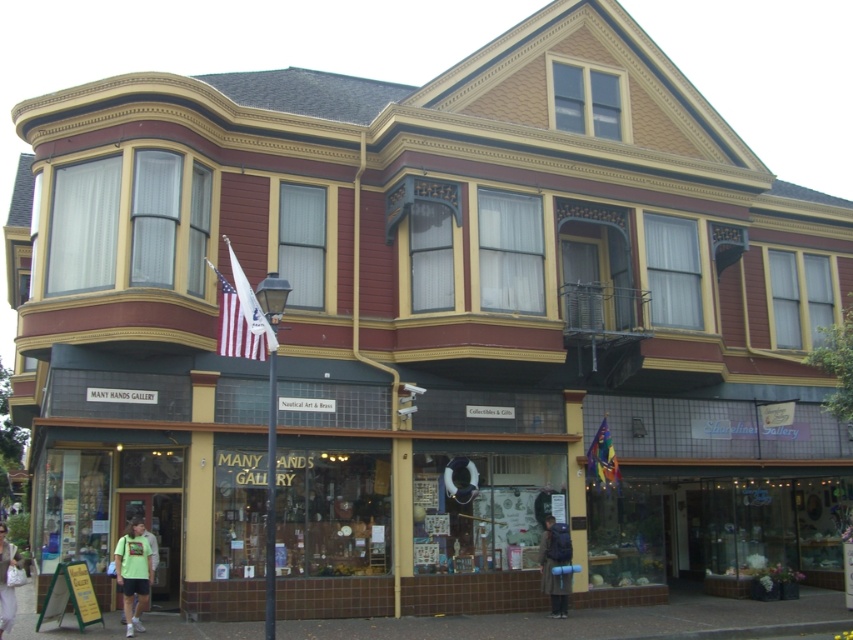
You are standing in front of the Victorian building and want to place a new decorative item between the rainbow fabric flag at center and the green fabric bag at lower left. The item you have is 2 meters long. Can you fit it between them without moving either object?

The distance between the rainbow fabric flag at center and the green fabric bag at lower left is 11.70 meters. Since the item is only 2 meters long, it can easily fit within the available space between them.